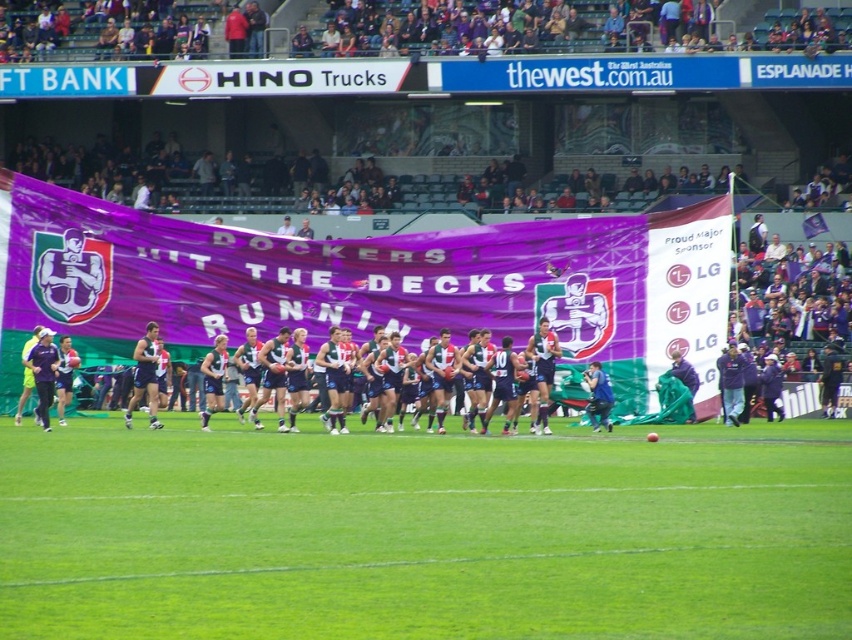
Is green grass at center thinner than dark blue jersey at center?

No, green grass at center is not thinner than dark blue jersey at center.

Who is higher up, green grass at center or dark blue jersey at center?

Positioned higher is dark blue jersey at center.

This screenshot has height=640, width=852. What are the coordinates of `green grass at center` in the screenshot? It's located at pos(426,532).